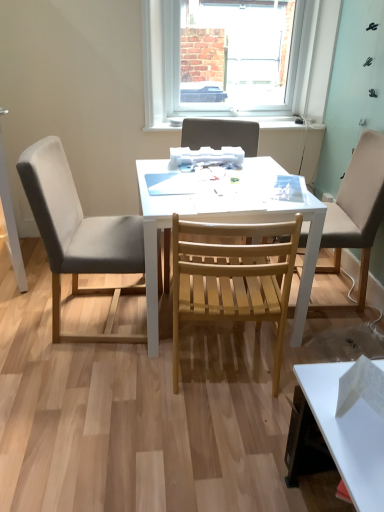
Question: Is the surface of wooden slatted chair at center, which is the third chair from right to left, in direct contact with natural wood chair at center, which is counted as the 2th chair, starting from the right?

Choices:
 (A) yes
 (B) no

Answer: (B)

Question: Is wooden slatted chair at center, positioned as the second chair in left-to-right order, shorter than natural wood chair at center, which is the 3th chair from left to right?

Choices:
 (A) yes
 (B) no

Answer: (B)

Question: Does wooden slatted chair at center, positioned as the second chair in left-to-right order, appear on the left side of natural wood chair at center, which is the 3th chair from left to right?

Choices:
 (A) yes
 (B) no

Answer: (A)

Question: Is wooden slatted chair at center, which is the third chair from right to left, bigger than natural wood chair at center, which is the 3th chair from left to right?

Choices:
 (A) no
 (B) yes

Answer: (B)

Question: Would you say wooden slatted chair at center, positioned as the second chair in left-to-right order, is a long distance from natural wood chair at center, which is counted as the 2th chair, starting from the right?

Choices:
 (A) yes
 (B) no

Answer: (A)

Question: From a real-world perspective, is wooden slatted chair at center, positioned as the second chair in left-to-right order, on top of natural wood chair at center, which is the 3th chair from left to right?

Choices:
 (A) yes
 (B) no

Answer: (A)

Question: Is wooden slatted chair at center, marked as the 4th chair in a left-to-right arrangement, smaller than white plastic window at upper center?

Choices:
 (A) yes
 (B) no

Answer: (B)

Question: From a real-world perspective, is wooden slatted chair at center, the first chair when ordered from right to left, located higher than white plastic window at upper center?

Choices:
 (A) no
 (B) yes

Answer: (A)

Question: From the image's perspective, is wooden slatted chair at center, marked as the 4th chair in a left-to-right arrangement, over white plastic window at upper center?

Choices:
 (A) no
 (B) yes

Answer: (A)

Question: Does wooden slatted chair at center, the first chair when ordered from right to left, have a greater height compared to white plastic window at upper center?

Choices:
 (A) no
 (B) yes

Answer: (B)

Question: Is wooden slatted chair at center, the first chair when ordered from right to left, not near white plastic window at upper center?

Choices:
 (A) no
 (B) yes

Answer: (B)

Question: Is the surface of wooden slatted chair at center, the first chair when ordered from right to left, in direct contact with white plastic window at upper center?

Choices:
 (A) no
 (B) yes

Answer: (A)

Question: Is white matte desk at center at the back of wooden slatted chair at center, the first chair when ordered from right to left?

Choices:
 (A) yes
 (B) no

Answer: (B)